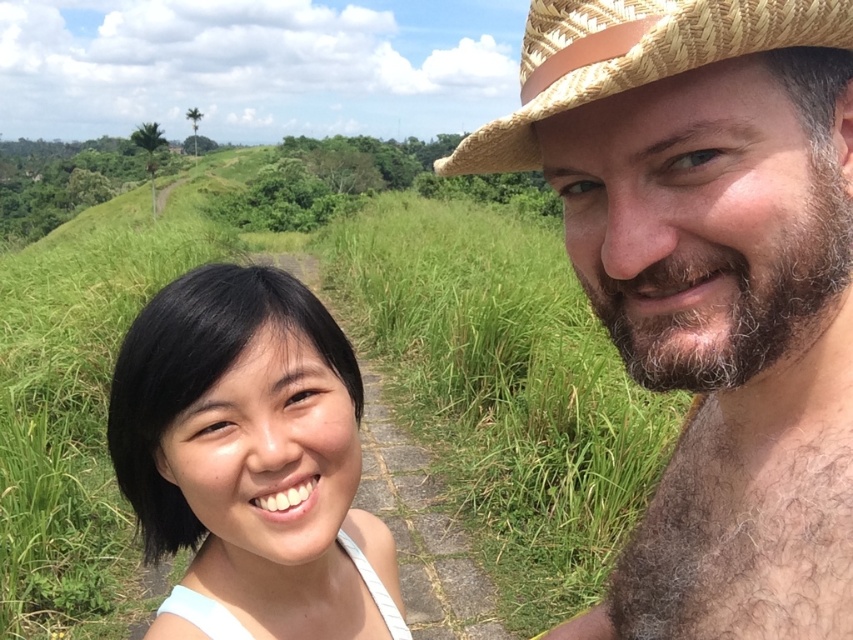
Question: Does black hair at center appear on the left side of green grass at center?

Choices:
 (A) yes
 (B) no

Answer: (B)

Question: Can you confirm if black hair at center is positioned to the left of brown woven cowboy hat at upper right?

Choices:
 (A) yes
 (B) no

Answer: (A)

Question: Which object is the farthest from the green grass at center?

Choices:
 (A) natural straw hat at center
 (B) black hair at center

Answer: (A)

Question: Does natural straw hat at center have a lesser width compared to black hair at center?

Choices:
 (A) no
 (B) yes

Answer: (B)

Question: Which of the following is the farthest from the observer?

Choices:
 (A) black hair at center
 (B) green grass at center

Answer: (B)

Question: Which of the following is the farthest from the observer?

Choices:
 (A) (589, 26)
 (B) (521, 140)
 (C) (431, 582)

Answer: (C)